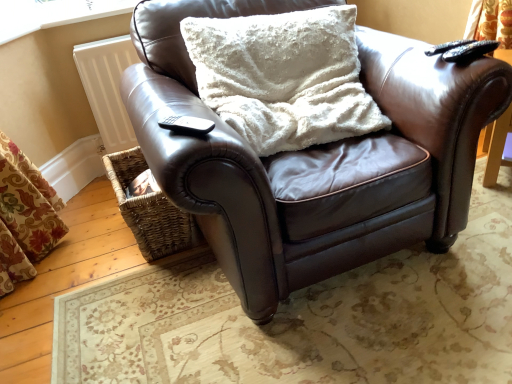
The image size is (512, 384). What do you see at coordinates (149, 207) in the screenshot?
I see `woven brown basket at lower left` at bounding box center [149, 207].

What do you see at coordinates (314, 158) in the screenshot? I see `brown leather chair at center` at bounding box center [314, 158].

In order to face white painted wood at upper left, should I rotate leftwards or rightwards?

Turn left approximately 23.115 degrees to face it.

The width and height of the screenshot is (512, 384). I want to click on black matte remote at upper right, acting as the second remote starting from the bottom, so click(x=468, y=50).

In order to click on white fluffy pillow at center in this screenshot , I will do `click(284, 77)`.

Locate an element on the screen. woven brown basket at lower left is located at coordinates (149, 207).

From the image's perspective, between black plastic remote at lower left, placed as the 2th remote when sorted from right to left, and black matte remote at upper right, which is the 1th remote in top-to-bottom order, which one is located above?

black matte remote at upper right, which is the 1th remote in top-to-bottom order, from the image's perspective.

From the picture: Can you confirm if black plastic remote at lower left, marked as the second remote in a back-to-front arrangement, is taller than black matte remote at upper right, which appears as the second remote when viewed from the front?

No, black plastic remote at lower left, marked as the second remote in a back-to-front arrangement, is not taller than black matte remote at upper right, which appears as the second remote when viewed from the front.

Is black plastic remote at lower left, placed as the 2th remote when sorted from right to left, not within black matte remote at upper right, arranged as the 1th remote when viewed from the back?

Yes, black plastic remote at lower left, placed as the 2th remote when sorted from right to left, is located beyond the bounds of black matte remote at upper right, arranged as the 1th remote when viewed from the back.

Is black plastic remote at lower left, placed as the first remote when sorted from front to back, turned away from black matte remote at upper right, the 1th remote from the right?

No, black matte remote at upper right, the 1th remote from the right, is not at the back of black plastic remote at lower left, placed as the first remote when sorted from front to back.

Can you confirm if woven brown basket at lower left is positioned to the left of white painted wood at upper left?

No.

Which is less distant, (x=130, y=184) or (x=61, y=8)?

Point (x=130, y=184).

Would you consider woven brown basket at lower left to be distant from white painted wood at upper left?

No, woven brown basket at lower left is not far away from white painted wood at upper left.

Does woven brown basket at lower left lie behind white painted wood at upper left?

No, woven brown basket at lower left is closer to the camera.

Based on the photo, from the image's perspective, is white painted wood at upper left located beneath brown leather chair at center?

No, from the image's perspective, white painted wood at upper left is not below brown leather chair at center.

How many degrees apart are the facing directions of white painted wood at upper left and brown leather chair at center?

The angle between the facing direction of white painted wood at upper left and the facing direction of brown leather chair at center is 3.1 degrees.

Can you confirm if white painted wood at upper left is smaller than brown leather chair at center?

Yes.

Is white painted wood at upper left oriented towards brown leather chair at center?

No, white painted wood at upper left does not turn towards brown leather chair at center.

From a real-world perspective, which is physically above, white painted wood at upper left or white fluffy pillow at center?

white painted wood at upper left is physically above.

Is white painted wood at upper left taller than white fluffy pillow at center?

In fact, white painted wood at upper left may be shorter than white fluffy pillow at center.

Is white painted wood at upper left positioned beyond the bounds of white fluffy pillow at center?

Absolutely, white painted wood at upper left is external to white fluffy pillow at center.

Is white painted wood at upper left wider than white fluffy pillow at center?

Incorrect, the width of white painted wood at upper left does not surpass that of white fluffy pillow at center.

From the picture: Is black matte remote at upper right, the 1th remote from the right, oriented away from woven brown basket at lower left?

black matte remote at upper right, the 1th remote from the right, is not turned away from woven brown basket at lower left.

From a real-world perspective, who is located higher, black matte remote at upper right, which ranks as the 2th remote in left-to-right order, or woven brown basket at lower left?

black matte remote at upper right, which ranks as the 2th remote in left-to-right order, from a real-world perspective.

In terms of width, does black matte remote at upper right, which appears as the second remote when viewed from the front, look wider or thinner when compared to woven brown basket at lower left?

Clearly, black matte remote at upper right, which appears as the second remote when viewed from the front, has less width compared to woven brown basket at lower left.

Considering the positions of objects black matte remote at upper right, the 1th remote from the right, and woven brown basket at lower left in the image provided, who is in front, black matte remote at upper right, the 1th remote from the right, or woven brown basket at lower left?

black matte remote at upper right, the 1th remote from the right, is closer to the camera.

Which object is positioned more to the left, woven brown basket at lower left or black matte remote at upper right, the 1th remote from the right?

From the viewer's perspective, woven brown basket at lower left appears more on the left side.

Is woven brown basket at lower left situated inside black matte remote at upper right, the 1th remote from the right, or outside?

woven brown basket at lower left cannot be found inside black matte remote at upper right, the 1th remote from the right.

From the image's perspective, is woven brown basket at lower left located beneath black matte remote at upper right, which is the 1th remote in top-to-bottom order?

Yes, from the image's perspective, woven brown basket at lower left is beneath black matte remote at upper right, which is the 1th remote in top-to-bottom order.

In terms of size, does woven brown basket at lower left appear bigger or smaller than black matte remote at upper right, arranged as the 1th remote when viewed from the back?

Clearly, woven brown basket at lower left is larger in size than black matte remote at upper right, arranged as the 1th remote when viewed from the back.

From a real-world perspective, is white painted wood at upper left over woven brown basket at lower left?

Indeed, from a real-world perspective, white painted wood at upper left stands above woven brown basket at lower left.

Image resolution: width=512 pixels, height=384 pixels. I want to click on window frame on the left of woven brown basket at lower left, so click(x=53, y=14).

Do you think white painted wood at upper left is within woven brown basket at lower left, or outside of it?

white painted wood at upper left lies outside woven brown basket at lower left.

The image size is (512, 384). Identify the location of remote located on the left of black matte remote at upper right, the 1th remote from the right. (187, 125).

Identify the location of basket below the white painted wood at upper left (from the image's perspective). (149, 207).

Estimate the real-world distances between objects in this image. Which object is closer to woven brown basket at lower left, white painted wood at upper left or black plastic remote at lower left, placed as the first remote when sorted from front to back?

The object closer to woven brown basket at lower left is black plastic remote at lower left, placed as the first remote when sorted from front to back.

Estimate the real-world distances between objects in this image. Which object is closer to woven brown basket at lower left, black plastic remote at lower left, placed as the first remote when sorted from front to back, or brown leather chair at center?

brown leather chair at center is closer to woven brown basket at lower left.

When comparing their distances from black matte remote at upper right, acting as the second remote starting from the bottom, does brown leather chair at center or white painted wood at upper left seem further?

white painted wood at upper left is positioned further to the anchor black matte remote at upper right, acting as the second remote starting from the bottom.

Consider the image. Which object lies nearer to the anchor point white painted wood at upper left, black matte remote at upper right, which is the 1th remote in top-to-bottom order, or black plastic remote at lower left, marked as the second remote in a back-to-front arrangement?

black plastic remote at lower left, marked as the second remote in a back-to-front arrangement.

When comparing their distances from brown leather chair at center, does black plastic remote at lower left, placed as the first remote when sorted from front to back, or woven brown basket at lower left seem closer?

The object closer to brown leather chair at center is black plastic remote at lower left, placed as the first remote when sorted from front to back.

Which object lies further to the anchor point black plastic remote at lower left, positioned as the 2th remote in top-to-bottom order, black matte remote at upper right, which appears as the second remote when viewed from the front, or woven brown basket at lower left?

black matte remote at upper right, which appears as the second remote when viewed from the front.

From the image, which object appears to be farther from white painted wood at upper left, black matte remote at upper right, acting as the second remote starting from the bottom, or woven brown basket at lower left?

black matte remote at upper right, acting as the second remote starting from the bottom, is further to white painted wood at upper left.

Looking at this image, considering their positions, is woven brown basket at lower left positioned closer to white painted wood at upper left than black plastic remote at lower left, acting as the 1th remote starting from the bottom?

woven brown basket at lower left is positioned closer to the anchor white painted wood at upper left.

Where is `chair between black plastic remote at lower left, the first remote positioned from the left, and black matte remote at upper right, arranged as the 1th remote when viewed from the back`? The width and height of the screenshot is (512, 384). chair between black plastic remote at lower left, the first remote positioned from the left, and black matte remote at upper right, arranged as the 1th remote when viewed from the back is located at coordinates (314, 158).

Find the location of a particular element. pillow between black plastic remote at lower left, placed as the 2th remote when sorted from right to left, and black matte remote at upper right, arranged as the 1th remote when viewed from the back, in the horizontal direction is located at coordinates (284, 77).

The width and height of the screenshot is (512, 384). I want to click on pillow between white painted wood at upper left and black matte remote at upper right, arranged as the 1th remote when viewed from the back, in the horizontal direction, so (x=284, y=77).

What are the coordinates of `pillow between brown leather chair at center and black matte remote at upper right, the 1th remote from the right, from left to right` in the screenshot? It's located at (284, 77).